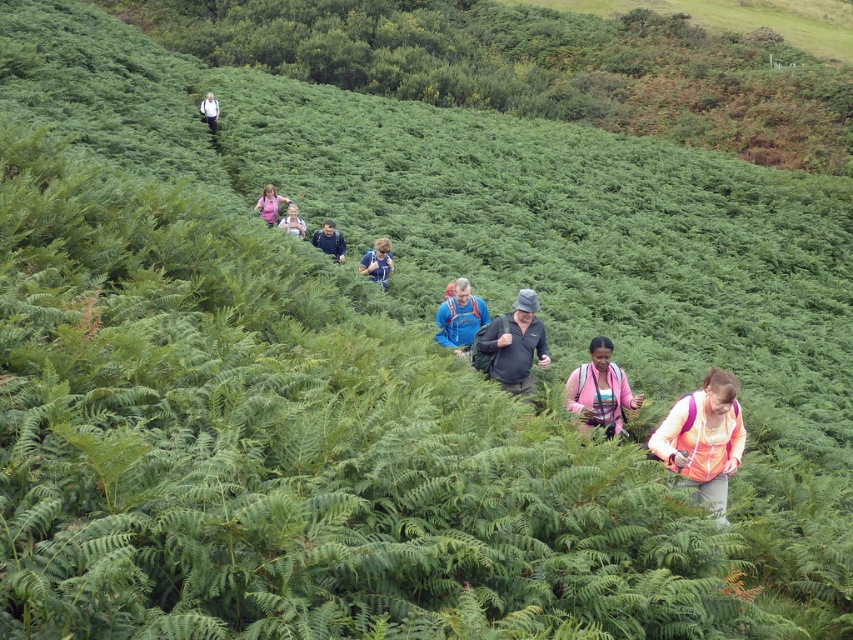
Question: Does pink fabric jacket at center have a lesser width compared to dark blue jacket at center?

Choices:
 (A) yes
 (B) no

Answer: (B)

Question: Among these points, which one is nearest to the camera?

Choices:
 (A) (381, 282)
 (B) (328, 227)
 (C) (287, 230)

Answer: (A)

Question: Considering the real-world distances, which object is farthest from the white fabric backpack at upper left?

Choices:
 (A) light pink fabric at center
 (B) blue fabric shirt at center

Answer: (B)

Question: Can you confirm if blue fabric backpack at center is wider than white fabric backpack at upper left?

Choices:
 (A) yes
 (B) no

Answer: (B)

Question: Is pink fabric jacket at center wider than light pink fabric at center?

Choices:
 (A) yes
 (B) no

Answer: (A)

Question: Based on their relative distances, which object is nearer to the dark gray fabric jacket at center?

Choices:
 (A) pink fabric backpack at center
 (B) blue fabric backpack at center

Answer: (B)